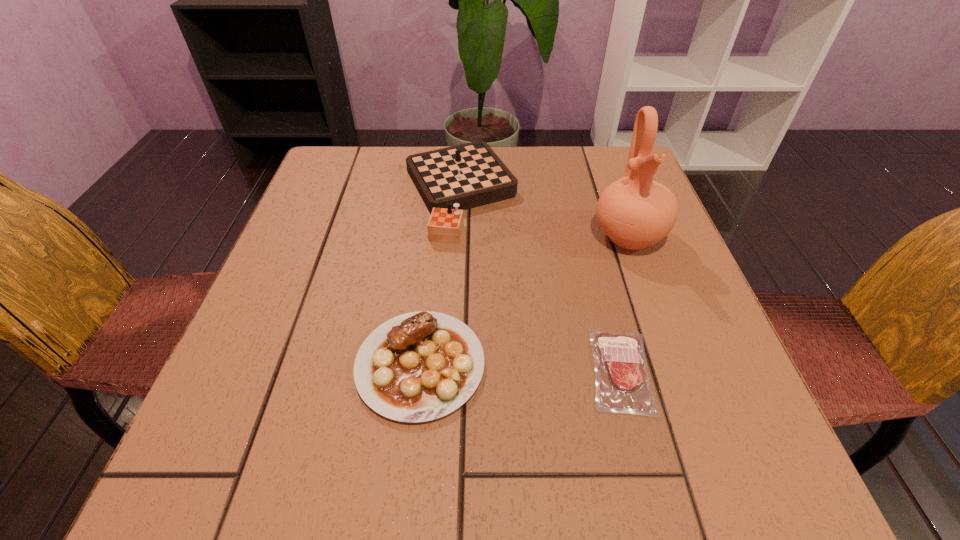
Where is `the tallest object`? This screenshot has height=540, width=960. the tallest object is located at coordinates (635, 212).

Image resolution: width=960 pixels, height=540 pixels. I want to click on chessboard, so click(x=449, y=180).

You are a GUI agent. You are given a task and a screenshot of the screen. Output one action in this format:
    pyautogui.click(x=<x>, y=<y>)
    Task: Click on the taller steak
    The width and height of the screenshot is (960, 540).
    Given the screenshot: What is the action you would take?
    pyautogui.click(x=420, y=366)

At what (x,y) coordinates should I click in order to perform the action: click on the left steak. Please return your answer as a coordinate pair (x, y). Image resolution: width=960 pixels, height=540 pixels. Looking at the image, I should click on (420, 366).

Find the location of a particular element. the shortest object is located at coordinates (622, 384).

The image size is (960, 540). What are the coordinates of `the shorter steak` in the screenshot? It's located at (622, 384).

At what (x,y) coordinates should I click in order to perform the action: click on free spot located 0.210m on the spout of the tallest object. Please return your answer as a coordinate pair (x, y). This screenshot has width=960, height=540. Looking at the image, I should click on click(x=668, y=347).

Image resolution: width=960 pixels, height=540 pixels. I want to click on free spot located 0.300m on the right of the chessboard, so click(642, 193).

Locate an element on the screen. The image size is (960, 540). vacant region located 0.050m on the right of the third tallest object is located at coordinates (515, 365).

The image size is (960, 540). I want to click on vacant area situated 0.100m on the right of the shorter steak, so point(715,370).